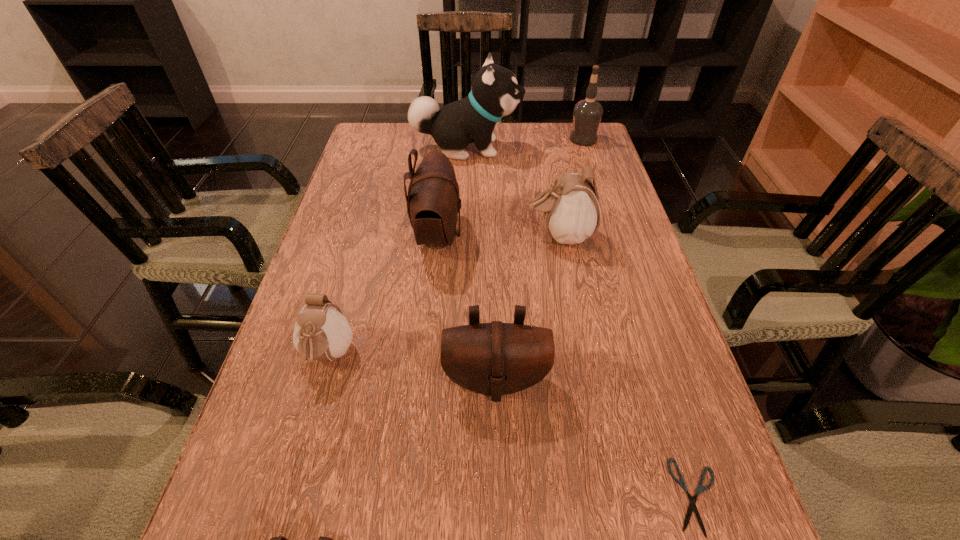
Find the location of a particular element. The width and height of the screenshot is (960, 540). free space located 0.110m at the face of the white puppy is located at coordinates tap(558, 148).

What are the coordinates of `vacant space located on the front label of the vodka` in the screenshot? It's located at (489, 139).

Where is `vacant space located 0.120m on the front label of the vodka`? The image size is (960, 540). vacant space located 0.120m on the front label of the vodka is located at coordinates tap(530, 139).

This screenshot has height=540, width=960. What are the coordinates of `free space located on the front label of the vodka` in the screenshot? It's located at (466, 139).

The height and width of the screenshot is (540, 960). What are the coordinates of `vacant space located with the flap open on the farthest brown pouch` in the screenshot? It's located at (538, 235).

You are a GUI agent. You are given a task and a screenshot of the screen. Output one action in this format:
    pyautogui.click(x=<x>, y=<y>)
    Task: Click on the vacant area located 0.400m on the front-facing side of the bigger white pouch
    This screenshot has height=540, width=960.
    Given the screenshot: What is the action you would take?
    pyautogui.click(x=358, y=236)

Where is `free region located on the front-facing side of the bigger white pouch`? free region located on the front-facing side of the bigger white pouch is located at coordinates (420, 236).

The width and height of the screenshot is (960, 540). Find the location of `free space located on the front-facing side of the bigger white pouch`. free space located on the front-facing side of the bigger white pouch is located at coordinates (496, 236).

Where is `vacant point located with the flap open on the second biggest brown pouch`? The width and height of the screenshot is (960, 540). vacant point located with the flap open on the second biggest brown pouch is located at coordinates (498, 485).

Image resolution: width=960 pixels, height=540 pixels. Identify the location of free location located on the front-facing side of the smaller white pouch. (300, 454).